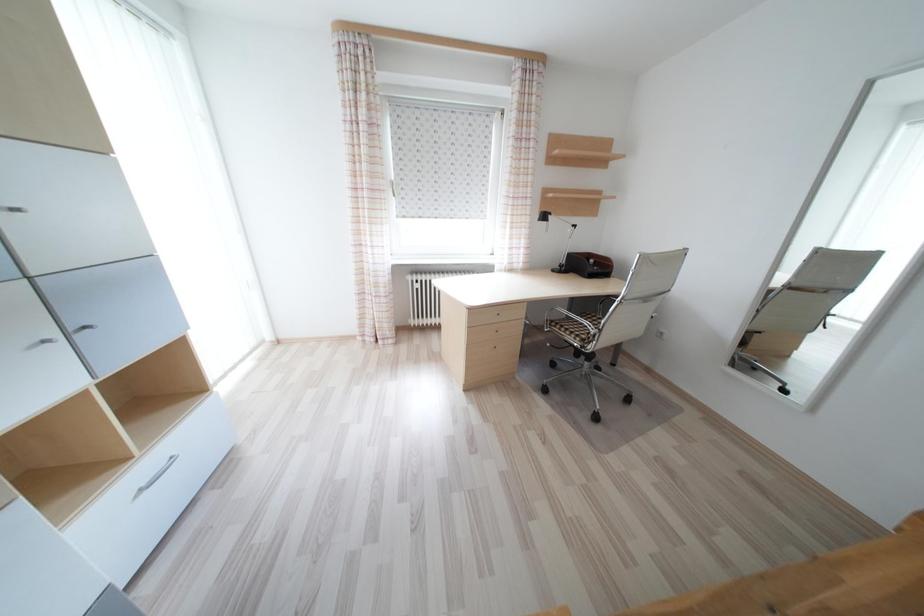
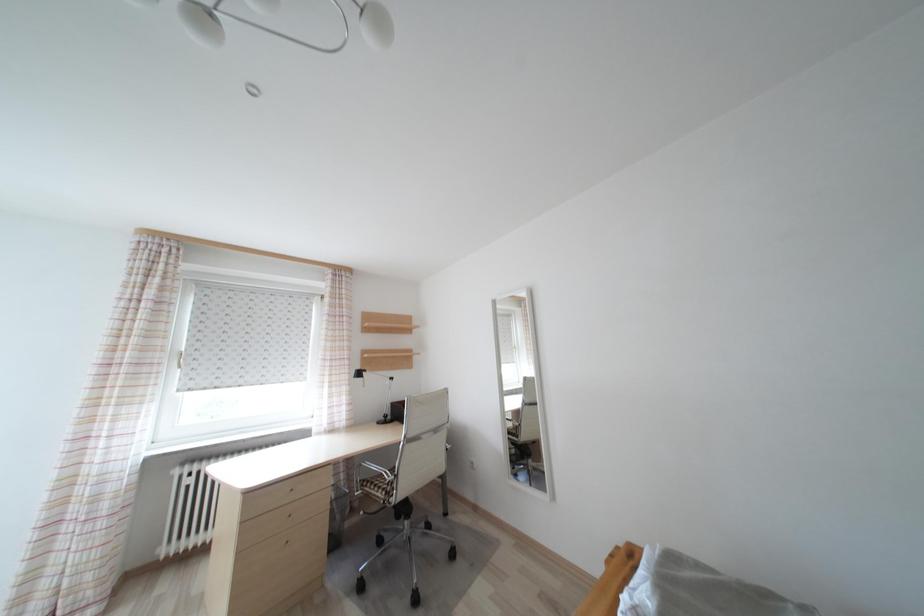
How did the camera likely rotate?

The camera's rotation is toward right-up.